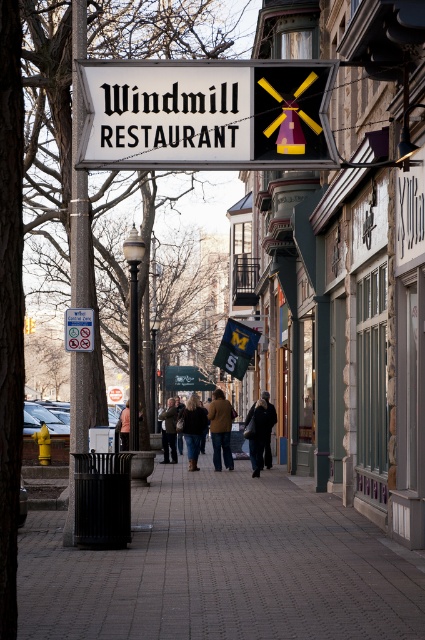
Question: Which object appears closest to the camera in this image?

Choices:
 (A) paved brick sidewalk at center
 (B) green fabric street sign at center
 (C) black metal pole at left
 (D) matte black sign at upper center

Answer: (A)

Question: Is black metal pole at left in front of dark brown leather jacket at center?

Choices:
 (A) no
 (B) yes

Answer: (B)

Question: Is paved brick sidewalk at center positioned behind denim jacket at center?

Choices:
 (A) yes
 (B) no

Answer: (B)

Question: Can you confirm if black metal pole at left is positioned to the right of green fabric street sign at center?

Choices:
 (A) yes
 (B) no

Answer: (B)

Question: Which point appears farthest from the camera in this image?

Choices:
 (A) (x=178, y=385)
 (B) (x=70, y=221)

Answer: (A)

Question: Which of the following is the closest to the observer?

Choices:
 (A) (169, 440)
 (B) (129, 426)
 (C) (209, 592)

Answer: (C)